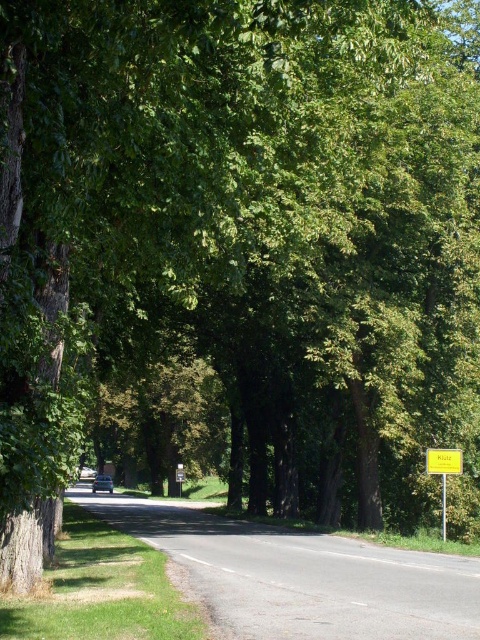
Based on the photo, does yellow plastic sign at center right have a lesser height compared to yellow plastic sign at right?

In fact, yellow plastic sign at center right may be taller than yellow plastic sign at right.

Between yellow plastic sign at center right and yellow plastic sign at right, which one has more height?

yellow plastic sign at center right

Between point (444, 470) and point (431, 468), which one is positioned in front?

Positioned in front is point (444, 470).

You are a GUI agent. You are given a task and a screenshot of the screen. Output one action in this format:
    pyautogui.click(x=<x>, y=<y>)
    Task: Click on the yellow plastic sign at center right
    
    Given the screenshot: What is the action you would take?
    pyautogui.click(x=444, y=472)

Is yellow plastic sign at center right to the right of metallic silver car at center from the viewer's perspective?

Indeed, yellow plastic sign at center right is positioned on the right side of metallic silver car at center.

Does yellow plastic sign at center right have a lesser height compared to metallic silver car at center?

Correct, yellow plastic sign at center right is not as tall as metallic silver car at center.

The image size is (480, 640). What do you see at coordinates (444, 472) in the screenshot?
I see `yellow plastic sign at center right` at bounding box center [444, 472].

Where is `yellow plastic sign at center right`? The height and width of the screenshot is (640, 480). yellow plastic sign at center right is located at coordinates (444, 472).

Can you confirm if yellow plastic sign at right is positioned above metallic silver car at center?

Yes.

Is point (436, 472) behind point (96, 476)?

That is False.

Does point (456, 458) come in front of point (108, 483)?

Yes, it is in front of point (108, 483).

The image size is (480, 640). Identify the location of yellow plastic sign at right. (444, 461).